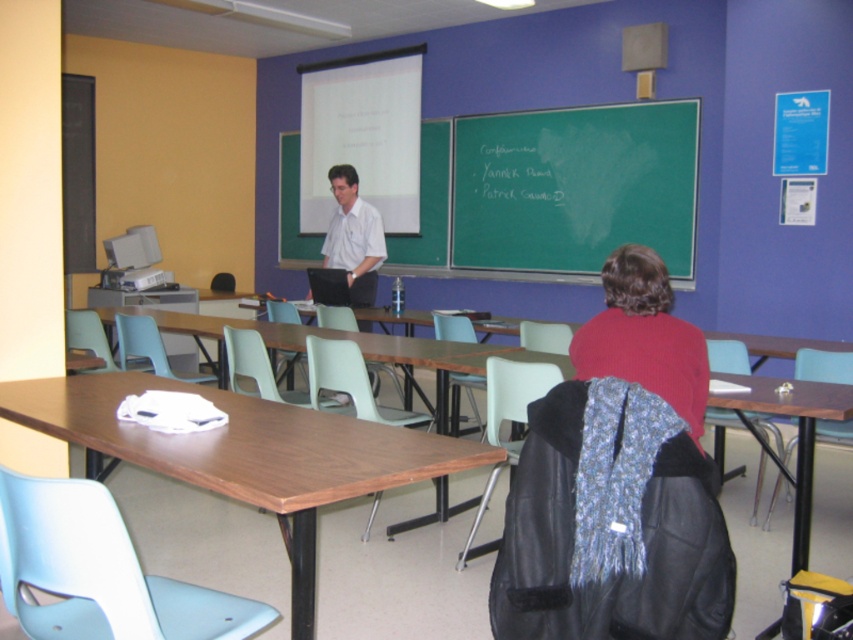
Who is more distant from viewer, (670, 332) or (381, 234)?

Positioned behind is point (381, 234).

Which is below, red knit sweater at center or white shirt at center?

red knit sweater at center is below.

Does point (679, 416) come in front of point (335, 176)?

That is True.

Find the location of a particular element. red knit sweater at center is located at coordinates (643, 337).

Which is more to the right, green chalkboard at center or white shirt at center?

green chalkboard at center

Can you confirm if green chalkboard at center is wider than white shirt at center?

Indeed, green chalkboard at center has a greater width compared to white shirt at center.

What do you see at coordinates (556, 189) in the screenshot? The width and height of the screenshot is (853, 640). I see `green chalkboard at center` at bounding box center [556, 189].

The width and height of the screenshot is (853, 640). Identify the location of green chalkboard at center. (556, 189).

Consider the image. Who is more forward, (373,433) or (361,241)?

Point (373,433)

This screenshot has height=640, width=853. Find the location of `wooden table at lower left`. wooden table at lower left is located at coordinates (247, 452).